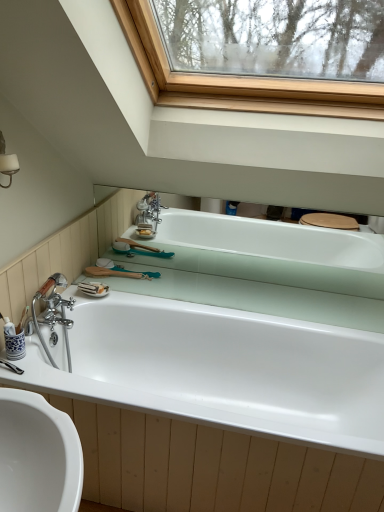
What do you see at coordinates (220, 369) in the screenshot? I see `white glossy bathtub at center, the first bathtub from the bottom` at bounding box center [220, 369].

You are a GUI agent. You are given a task and a screenshot of the screen. Output one action in this format:
    pyautogui.click(x=<x>, y=<y>)
    Task: Click on the white glossy bathtub at center, the first bathtub from the bottom
    The height and width of the screenshot is (512, 384).
    Given the screenshot: What is the action you would take?
    pyautogui.click(x=220, y=369)

What is the approximate width of white glossy bathtub at center, which is the second bathtub in bottom-to-top order?

white glossy bathtub at center, which is the second bathtub in bottom-to-top order, is 1.49 inches wide.

Describe the element at coordinates (272, 252) in the screenshot. I see `white glossy bathtub at center, which is the second bathtub in bottom-to-top order` at that location.

In the scene shown: Measure the distance between white glossy bathtub at center, which is the first bathtub in top-to-bottom order, and camera.

white glossy bathtub at center, which is the first bathtub in top-to-bottom order, and camera are 2.14 meters apart.

Identify the location of white glossy bathtub at center, which is the first bathtub in top-to-bottom order. Image resolution: width=384 pixels, height=512 pixels. pyautogui.click(x=272, y=252).

This screenshot has height=512, width=384. I want to click on white glossy bathtub at center, the 2th bathtub in the top-to-bottom sequence, so click(220, 369).

Is white glossy bathtub at center, which is the first bathtub in top-to-bottom order, to the right of white glossy bathtub at center, the 2th bathtub in the top-to-bottom sequence, from the viewer's perspective?

Yes.

Consider the image. Between white glossy bathtub at center, which is the second bathtub in bottom-to-top order, and white glossy bathtub at center, the 2th bathtub in the top-to-bottom sequence, which one is positioned behind?

white glossy bathtub at center, which is the second bathtub in bottom-to-top order, is more distant.

Considering the positions of points (194, 233) and (173, 411), is point (194, 233) closer to camera compared to point (173, 411)?

No, (194, 233) is further to viewer.

From the image's perspective, is white glossy bathtub at center, which is the second bathtub in bottom-to-top order, located above or below white glossy bathtub at center, the first bathtub from the bottom?

Based on their image positions, white glossy bathtub at center, which is the second bathtub in bottom-to-top order, is located above white glossy bathtub at center, the first bathtub from the bottom.

From a real-world perspective, between white glossy bathtub at center, which is the first bathtub in top-to-bottom order, and white glossy bathtub at center, the 2th bathtub in the top-to-bottom sequence, who is vertically lower?

white glossy bathtub at center, the 2th bathtub in the top-to-bottom sequence, is physically lower.

Which object is thinner, white glossy bathtub at center, which is the second bathtub in bottom-to-top order, or white glossy bathtub at center, the first bathtub from the bottom?

Thinner between the two is white glossy bathtub at center, which is the second bathtub in bottom-to-top order.

Which of these two, white glossy bathtub at center, which is the second bathtub in bottom-to-top order, or white glossy bathtub at center, the 2th bathtub in the top-to-bottom sequence, stands taller?

Standing taller between the two is white glossy bathtub at center, the 2th bathtub in the top-to-bottom sequence.

Considering the sizes of objects white glossy bathtub at center, which is the second bathtub in bottom-to-top order, and white glossy bathtub at center, the first bathtub from the bottom, in the image provided, who is bigger, white glossy bathtub at center, which is the second bathtub in bottom-to-top order, or white glossy bathtub at center, the first bathtub from the bottom,?

With larger size is white glossy bathtub at center, the first bathtub from the bottom.

Choose the correct answer: Is white glossy bathtub at center, which is the second bathtub in bottom-to-top order, inside white glossy bathtub at center, the 2th bathtub in the top-to-bottom sequence, or outside it?

white glossy bathtub at center, which is the second bathtub in bottom-to-top order, cannot be found inside white glossy bathtub at center, the 2th bathtub in the top-to-bottom sequence.

Looking at this image, is white glossy bathtub at center, which is the first bathtub in top-to-bottom order, far away from white glossy bathtub at center, the first bathtub from the bottom?

No, there isn't a large distance between white glossy bathtub at center, which is the first bathtub in top-to-bottom order, and white glossy bathtub at center, the first bathtub from the bottom.

Is white glossy bathtub at center, which is the second bathtub in bottom-to-top order, oriented away from white glossy bathtub at center, the first bathtub from the bottom?

No, white glossy bathtub at center, which is the second bathtub in bottom-to-top order, is not facing away from white glossy bathtub at center, the first bathtub from the bottom.

From the picture: Measure the distance from white glossy bathtub at center, which is the first bathtub in top-to-bottom order, to white glossy bathtub at center, the 2th bathtub in the top-to-bottom sequence.

white glossy bathtub at center, which is the first bathtub in top-to-bottom order, and white glossy bathtub at center, the 2th bathtub in the top-to-bottom sequence, are 30.09 inches apart.

Identify the location of bathtub below the white glossy bathtub at center, which is the first bathtub in top-to-bottom order (from the image's perspective). pyautogui.click(x=220, y=369).

In the image, is white glossy bathtub at center, the first bathtub from the bottom, on the left side or the right side of white glossy bathtub at center, which is the second bathtub in bottom-to-top order?

Based on their positions, white glossy bathtub at center, the first bathtub from the bottom, is located to the left of white glossy bathtub at center, which is the second bathtub in bottom-to-top order.

Between white glossy bathtub at center, the 2th bathtub in the top-to-bottom sequence, and white glossy bathtub at center, which is the second bathtub in bottom-to-top order, which one is positioned in front?

white glossy bathtub at center, the 2th bathtub in the top-to-bottom sequence, is more forward.

Does point (126, 304) appear closer or farther from the camera than point (262, 230)?

Clearly, point (126, 304) is closer to the camera than point (262, 230).

From the image's perspective, is white glossy bathtub at center, the first bathtub from the bottom, located above or below white glossy bathtub at center, which is the second bathtub in bottom-to-top order?

white glossy bathtub at center, the first bathtub from the bottom, is below white glossy bathtub at center, which is the second bathtub in bottom-to-top order.

From a real-world perspective, relative to white glossy bathtub at center, which is the first bathtub in top-to-bottom order, is white glossy bathtub at center, the 2th bathtub in the top-to-bottom sequence, vertically above or below?

Clearly, from a real-world perspective, white glossy bathtub at center, the 2th bathtub in the top-to-bottom sequence, is below white glossy bathtub at center, which is the first bathtub in top-to-bottom order.

Which object is wider, white glossy bathtub at center, the first bathtub from the bottom, or white glossy bathtub at center, which is the second bathtub in bottom-to-top order?

white glossy bathtub at center, the first bathtub from the bottom, is wider.

Considering the relative sizes of white glossy bathtub at center, the first bathtub from the bottom, and white glossy bathtub at center, which is the first bathtub in top-to-bottom order, in the image provided, is white glossy bathtub at center, the first bathtub from the bottom, taller than white glossy bathtub at center, which is the first bathtub in top-to-bottom order,?

Yes.

Between white glossy bathtub at center, the first bathtub from the bottom, and white glossy bathtub at center, which is the second bathtub in bottom-to-top order, which one has larger size?

With larger size is white glossy bathtub at center, the first bathtub from the bottom.

Is white glossy bathtub at center, the 2th bathtub in the top-to-bottom sequence, outside of white glossy bathtub at center, which is the first bathtub in top-to-bottom order?

That's correct, white glossy bathtub at center, the 2th bathtub in the top-to-bottom sequence, is outside of white glossy bathtub at center, which is the first bathtub in top-to-bottom order.

Is white glossy bathtub at center, the first bathtub from the bottom, far away from white glossy bathtub at center, which is the second bathtub in bottom-to-top order?

Actually, white glossy bathtub at center, the first bathtub from the bottom, and white glossy bathtub at center, which is the second bathtub in bottom-to-top order, are a little close together.

Is white glossy bathtub at center, the 2th bathtub in the top-to-bottom sequence, facing towards white glossy bathtub at center, which is the first bathtub in top-to-bottom order?

No, white glossy bathtub at center, the 2th bathtub in the top-to-bottom sequence, does not turn towards white glossy bathtub at center, which is the first bathtub in top-to-bottom order.

Can you tell me how much white glossy bathtub at center, the 2th bathtub in the top-to-bottom sequence, and white glossy bathtub at center, which is the second bathtub in bottom-to-top order, differ in facing direction?

0.789 degrees separate the facing orientations of white glossy bathtub at center, the 2th bathtub in the top-to-bottom sequence, and white glossy bathtub at center, which is the second bathtub in bottom-to-top order.

Locate an element on the screen. This screenshot has width=384, height=512. bathtub lying below the white glossy bathtub at center, which is the second bathtub in bottom-to-top order (from the image's perspective) is located at coordinates (220, 369).

Identify the location of bathtub that is below the white glossy bathtub at center, which is the first bathtub in top-to-bottom order (from the image's perspective). This screenshot has height=512, width=384. (220, 369).

You are a GUI agent. You are given a task and a screenshot of the screen. Output one action in this format:
    pyautogui.click(x=<x>, y=<y>)
    Task: Click on the bathtub behind the white glossy bathtub at center, the first bathtub from the bottom
    This screenshot has width=384, height=512.
    Given the screenshot: What is the action you would take?
    pyautogui.click(x=272, y=252)